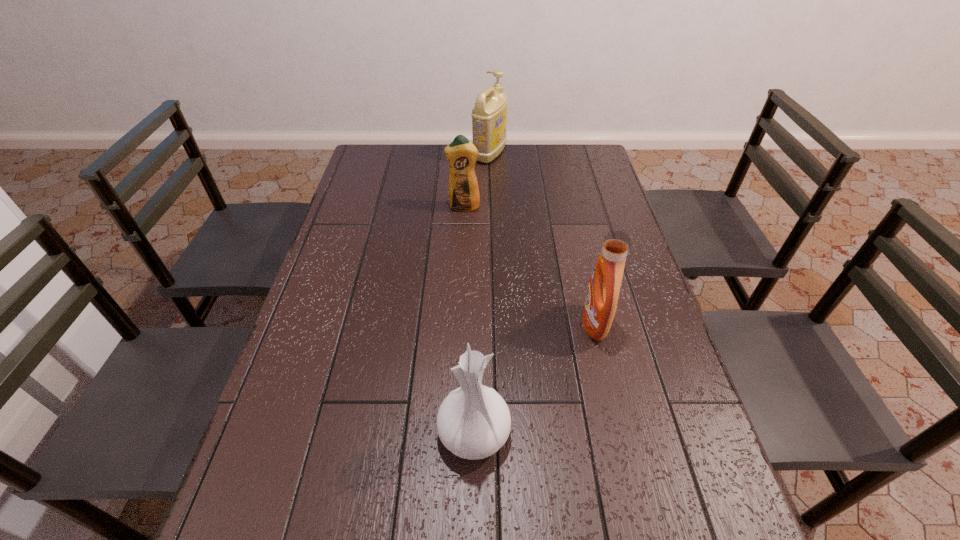
Identify the location of free space in the image that satisfies the following two spatial constraints: 1. on the back side of the nearest object; 2. on the left side of the farthest detergent. (477, 155).